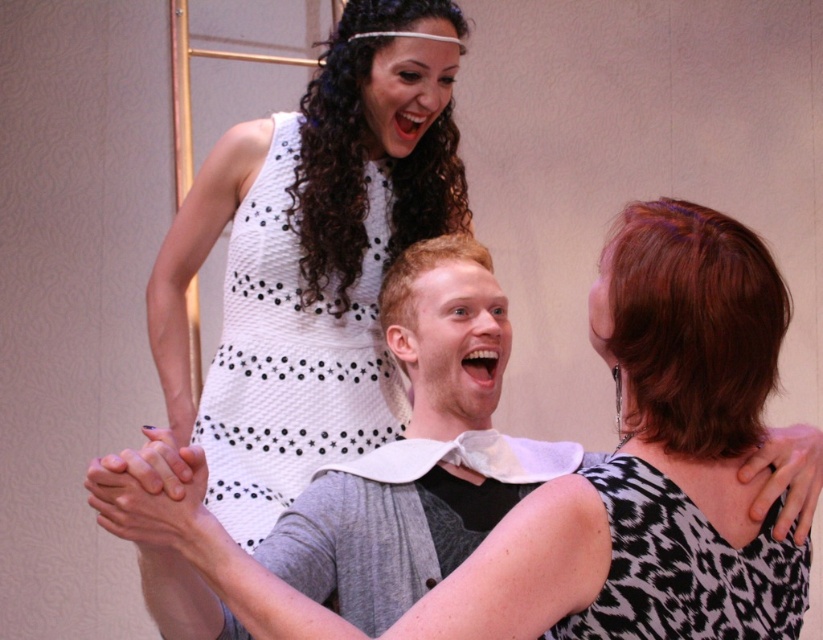
Can you confirm if white dotted dress at upper center is positioned to the left of black and white printed dress at upper right?

Correct, you'll find white dotted dress at upper center to the left of black and white printed dress at upper right.

Does white dotted dress at upper center appear on the right side of black and white printed dress at upper right?

In fact, white dotted dress at upper center is to the left of black and white printed dress at upper right.

Identify the location of white dotted dress at upper center. The image size is (823, 640). [573, 477].

At what (x,y) coordinates should I click in order to perform the action: click on white dotted dress at upper center. Please return your answer as a coordinate pair (x, y). Looking at the image, I should click on (573, 477).

From the picture: Between white dotted dress at upper center and white dotted fabric dress at upper center, which one appears on the left side from the viewer's perspective?

white dotted fabric dress at upper center

What do you see at coordinates (573, 477) in the screenshot?
I see `white dotted dress at upper center` at bounding box center [573, 477].

Where is `white dotted dress at upper center`? The width and height of the screenshot is (823, 640). white dotted dress at upper center is located at coordinates (573, 477).

Is white dotted fabric dress at upper center thinner than black and white printed dress at upper right?

In fact, white dotted fabric dress at upper center might be wider than black and white printed dress at upper right.

Does white dotted fabric dress at upper center have a lesser height compared to black and white printed dress at upper right?

In fact, white dotted fabric dress at upper center may be taller than black and white printed dress at upper right.

Who is more distant from viewer, [245,333] or [780,576]?

The point [245,333] is behind.

At what (x,y) coordinates should I click in order to perform the action: click on white dotted fabric dress at upper center. Please return your answer as a coordinate pair (x, y). Looking at the image, I should click on (291, 355).